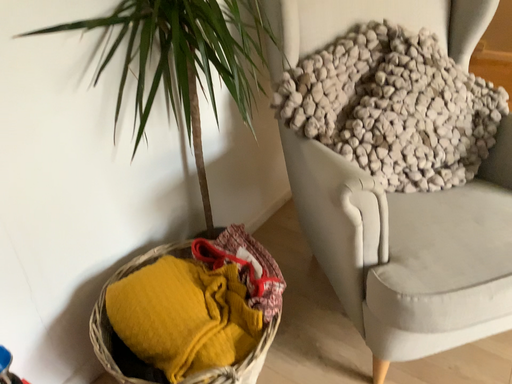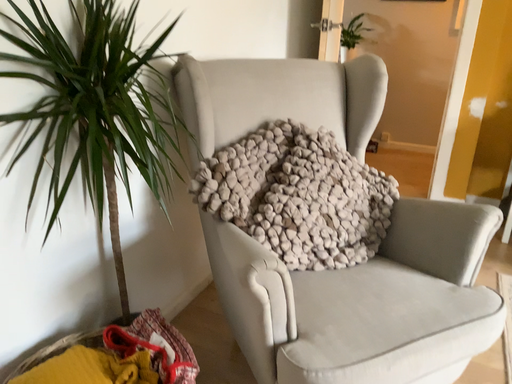
Question: Which way did the camera rotate in the video?

Choices:
 (A) rotated upward
 (B) rotated downward

Answer: (A)